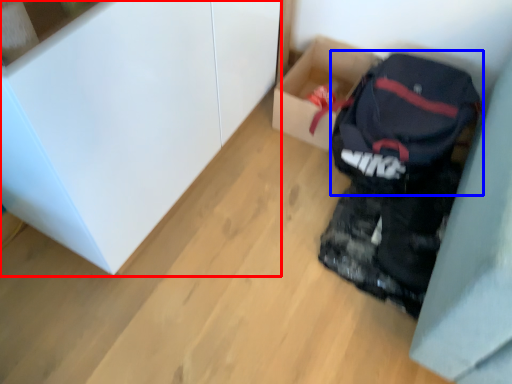
Question: Which object is closer to the camera taking this photo, cabinetry (highlighted by a red box) or backpack (highlighted by a blue box)?

Choices:
 (A) cabinetry
 (B) backpack

Answer: (A)